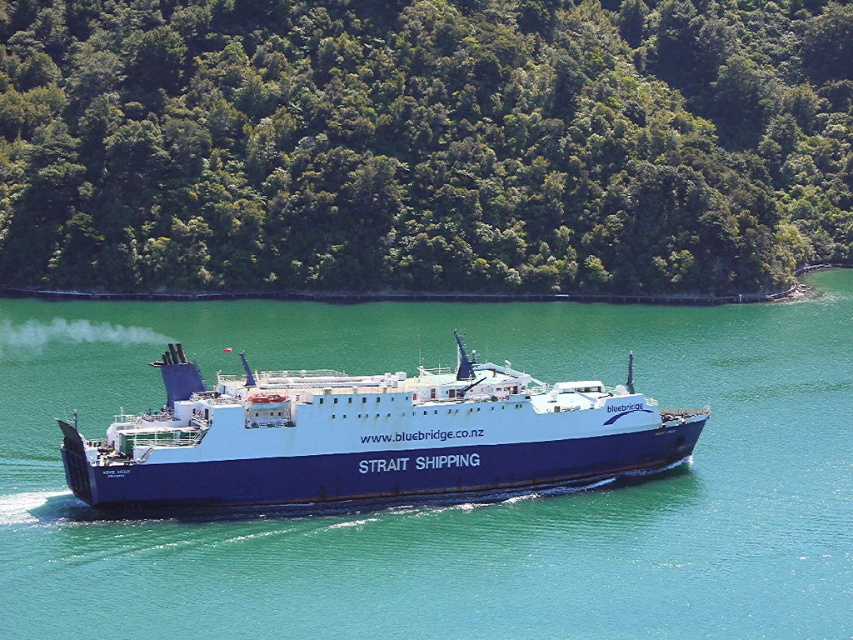
Does green leafy trees at center have a lesser height compared to blue matte ship at center?

No, green leafy trees at center is not shorter than blue matte ship at center.

What do you see at coordinates (422, 145) in the screenshot?
I see `green leafy trees at center` at bounding box center [422, 145].

Is point (770, 20) positioned in front of point (186, 368)?

No.

Image resolution: width=853 pixels, height=640 pixels. I want to click on green leafy trees at center, so click(x=422, y=145).

Is point (737, 234) farther from viewer compared to point (544, 568)?

Yes, point (737, 234) is farther from viewer.

Is green leafy trees at center in front of blue-green water at center?

No, green leafy trees at center is further to the viewer.

Image resolution: width=853 pixels, height=640 pixels. I want to click on green leafy trees at center, so click(422, 145).

Is blue-green water at center behind blue matte ship at center?

No, blue-green water at center is closer to the viewer.

Is point (630, 314) more distant than point (691, 429)?

Yes, point (630, 314) is farther from viewer.

Does point (804, 406) come behind point (450, 468)?

Yes, point (804, 406) is farther from viewer.

This screenshot has height=640, width=853. I want to click on blue-green water at center, so click(450, 508).